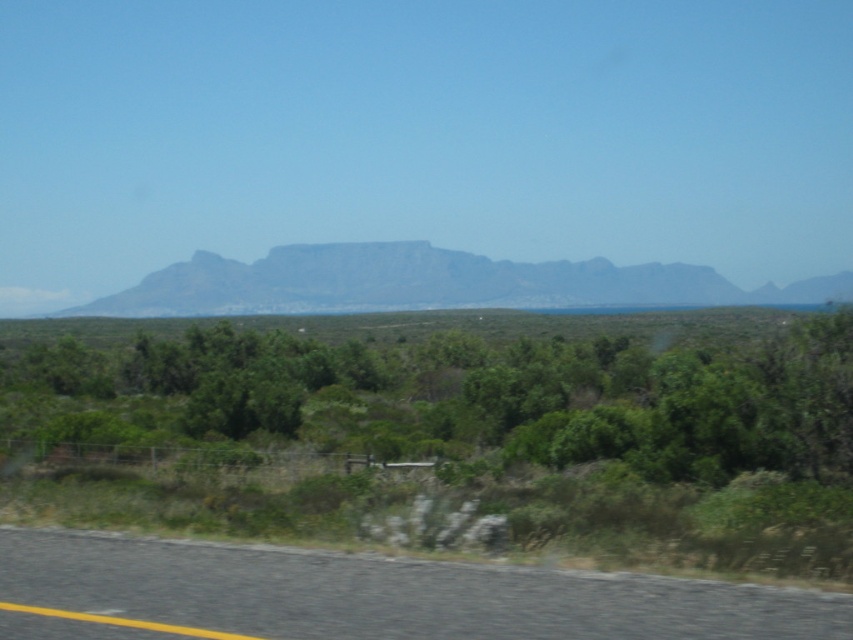
You are driving a car and see the black asphalt road at lower left and the gray rocky mountain at center. Which object is closer to your current position?

The black asphalt road at lower left is closer to your current position because it is in front of the gray rocky mountain at center.